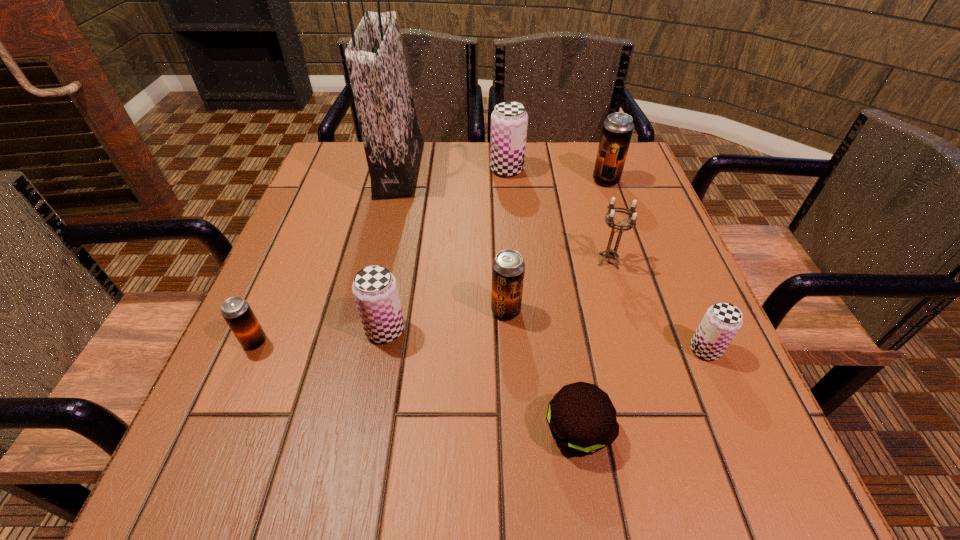
Where is `object present at the far left corner`? object present at the far left corner is located at coordinates (393, 144).

Where is `object at the far right corner`? The image size is (960, 540). object at the far right corner is located at coordinates (617, 130).

The width and height of the screenshot is (960, 540). What are the coordinates of `free spot at the far edge of the desktop` in the screenshot? It's located at (446, 173).

The image size is (960, 540). In the image, there is a desktop. What are the coordinates of `vacant area at the near edge` in the screenshot? It's located at (540, 478).

Where is `blank area at the left edge`? blank area at the left edge is located at coordinates (283, 276).

Locate an element on the screen. vacant space at the right edge of the desktop is located at coordinates (679, 293).

Find the location of `blank space at the far left corner of the desktop`. blank space at the far left corner of the desktop is located at coordinates (340, 154).

The width and height of the screenshot is (960, 540). I want to click on free space that is in between the biggest purple beer can and the rightmost black beer can, so click(x=557, y=175).

Identify the location of empty space between the candle holder and the rightmost object. This screenshot has height=540, width=960. (657, 305).

I want to click on vacant area that lies between the fourth farthest object and the farthest purple beer can, so [558, 215].